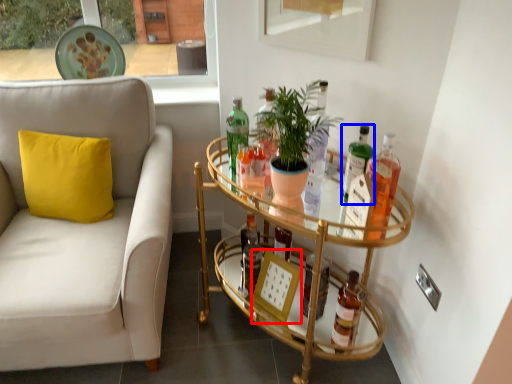
Question: Which object appears farthest to the camera in this image, picture frame (highlighted by a red box) or bottle (highlighted by a blue box)?

Choices:
 (A) picture frame
 (B) bottle

Answer: (A)